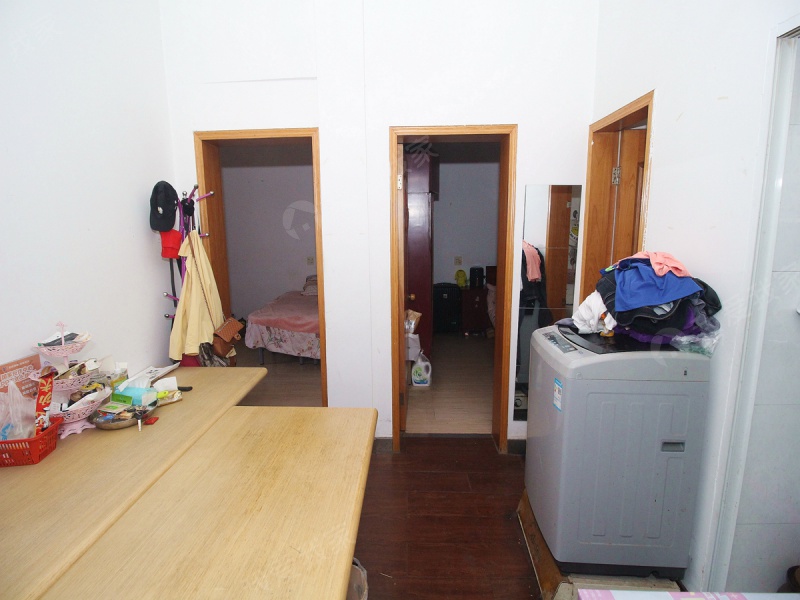
Image resolution: width=800 pixels, height=600 pixels. I want to click on dark brown shelf, so click(420, 251).